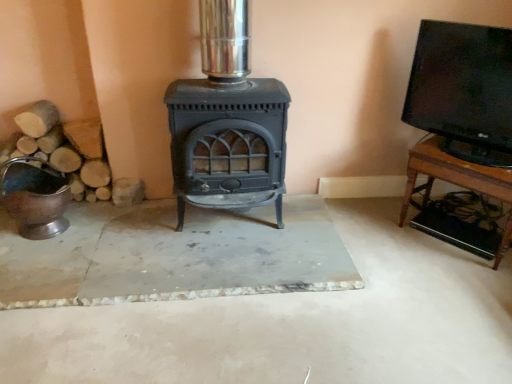
Locate an element on the screen. vacant space underneath shiny metallic bucket at left (from a real-world perspective) is located at coordinates (64, 229).